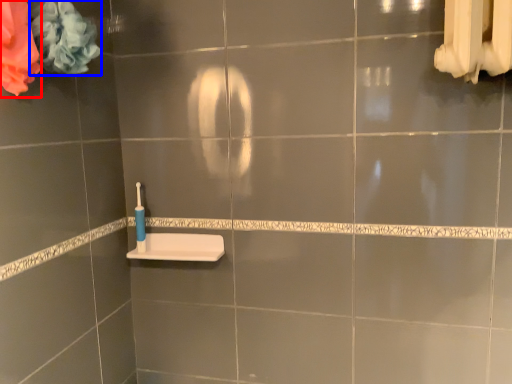
Question: Which of the following is the closest to the observer, flower (highlighted by a red box) or flower (highlighted by a blue box)?

Choices:
 (A) flower
 (B) flower

Answer: (A)